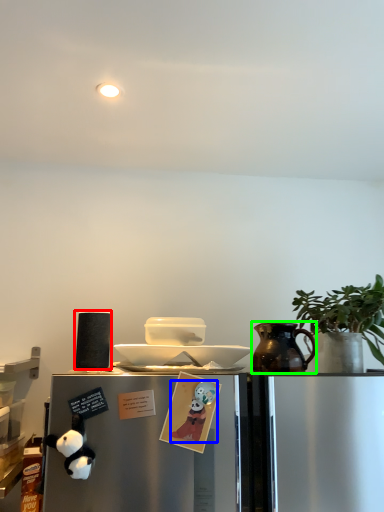
Question: Estimate the real-world distances between objects in this image. Which object is farther from appliance (highlighted by a red box), toy (highlighted by a blue box) or jug (highlighted by a green box)?

Choices:
 (A) toy
 (B) jug

Answer: (B)